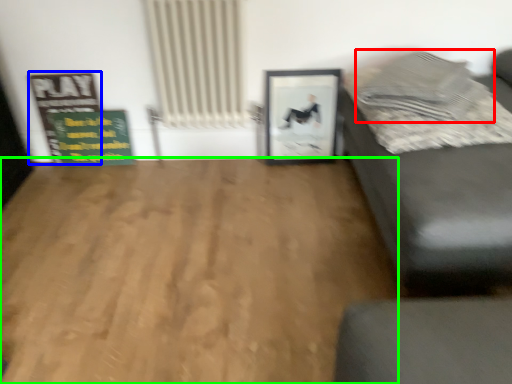
Question: Which object is the farthest from pillow (highlighted by a red box)? Choose among these: bulletin board (highlighted by a blue box) or hardwood (highlighted by a green box).

Choices:
 (A) bulletin board
 (B) hardwood

Answer: (A)